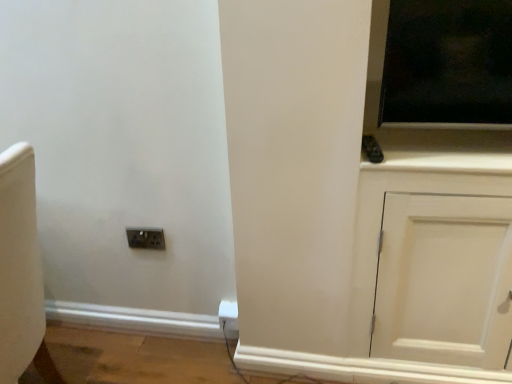
Question: Considering the relative sizes of metallic socket at lower left and white matte cabinet at right in the image provided, is metallic socket at lower left bigger than white matte cabinet at right?

Choices:
 (A) yes
 (B) no

Answer: (B)

Question: From a real-world perspective, does metallic socket at lower left stand above white matte cabinet at right?

Choices:
 (A) yes
 (B) no

Answer: (A)

Question: Is metallic socket at lower left further to camera compared to white matte cabinet at right?

Choices:
 (A) no
 (B) yes

Answer: (B)

Question: Considering the relative sizes of metallic socket at lower left and white matte cabinet at right in the image provided, is metallic socket at lower left taller than white matte cabinet at right?

Choices:
 (A) yes
 (B) no

Answer: (B)

Question: Considering the relative sizes of metallic socket at lower left and white matte cabinet at right in the image provided, is metallic socket at lower left shorter than white matte cabinet at right?

Choices:
 (A) no
 (B) yes

Answer: (B)

Question: Looking at the image, does metallic socket at lower left seem bigger or smaller compared to white matte cabinet at right?

Choices:
 (A) big
 (B) small

Answer: (B)

Question: Do you think metallic socket at lower left is within white matte cabinet at right, or outside of it?

Choices:
 (A) inside
 (B) outside

Answer: (B)

Question: In the image, is metallic socket at lower left positioned in front of or behind white matte cabinet at right?

Choices:
 (A) behind
 (B) front

Answer: (A)

Question: From the image's perspective, is metallic socket at lower left located above or below white matte cabinet at right?

Choices:
 (A) above
 (B) below

Answer: (A)

Question: In terms of size, does white matte cabinet at right appear bigger or smaller than metallic socket at lower left?

Choices:
 (A) big
 (B) small

Answer: (A)

Question: Is white matte cabinet at right inside the boundaries of metallic socket at lower left, or outside?

Choices:
 (A) inside
 (B) outside

Answer: (B)

Question: From a real-world perspective, is white matte cabinet at right physically located above or below metallic socket at lower left?

Choices:
 (A) below
 (B) above

Answer: (A)

Question: Is point (416, 289) positioned closer to the camera than point (134, 233)?

Choices:
 (A) farther
 (B) closer

Answer: (B)

Question: Is point (237, 311) closer or farther from the camera than point (144, 243)?

Choices:
 (A) closer
 (B) farther

Answer: (A)

Question: Looking at their shapes, would you say white plastic electric outlet at lower center is wider or thinner than metallic socket at lower left?

Choices:
 (A) thin
 (B) wide

Answer: (B)